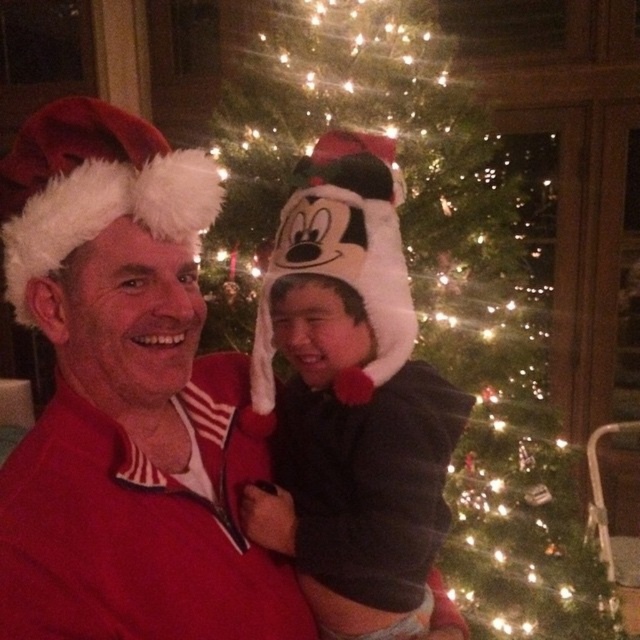
Does illuminated green christmas tree at center have a lesser width compared to matte red santa hat at left?

Incorrect, illuminated green christmas tree at center's width is not less than matte red santa hat at left's.

This screenshot has height=640, width=640. What are the coordinates of `illuminated green christmas tree at center` in the screenshot? It's located at (452, 253).

I want to click on illuminated green christmas tree at center, so (x=452, y=253).

What are the coordinates of `illuminated green christmas tree at center` in the screenshot? It's located at (452, 253).

This screenshot has height=640, width=640. What do you see at coordinates (452, 253) in the screenshot?
I see `illuminated green christmas tree at center` at bounding box center [452, 253].

Locate an element on the screen. The image size is (640, 640). illuminated green christmas tree at center is located at coordinates (452, 253).

I want to click on matte red santa hat at left, so click(x=125, y=400).

The height and width of the screenshot is (640, 640). In order to click on matte red santa hat at left in this screenshot , I will do `click(125, 400)`.

This screenshot has width=640, height=640. I want to click on matte red santa hat at left, so click(125, 400).